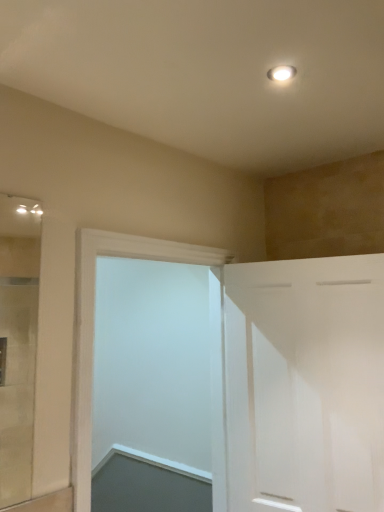
Question: In which direction should I rotate to look at white smooth door at center, acting as the first door starting from the left?

Choices:
 (A) left
 (B) right

Answer: (A)

Question: Is white matte cabinet at right, arranged as the first door when viewed from the right, facing away from white smooth door at center, the second door in the right-to-left sequence?

Choices:
 (A) yes
 (B) no

Answer: (B)

Question: Is white matte cabinet at right, arranged as the first door when viewed from the right, facing towards white smooth door at center, acting as the first door starting from the left?

Choices:
 (A) no
 (B) yes

Answer: (A)

Question: Is white matte cabinet at right, arranged as the first door when viewed from the right, taller than white smooth door at center, the second door in the right-to-left sequence?

Choices:
 (A) yes
 (B) no

Answer: (B)

Question: From a real-world perspective, is white matte cabinet at right, arranged as the first door when viewed from the right, below white smooth door at center, the second door in the right-to-left sequence?

Choices:
 (A) no
 (B) yes

Answer: (B)

Question: Is white matte cabinet at right, arranged as the first door when viewed from the right, wider than white smooth door at center, the second door in the right-to-left sequence?

Choices:
 (A) no
 (B) yes

Answer: (A)

Question: Is white matte cabinet at right, the 2th door from the left, not within white smooth door at center, acting as the first door starting from the left?

Choices:
 (A) no
 (B) yes

Answer: (B)

Question: Are white smooth door at center, acting as the first door starting from the left, and white matte cabinet at right, arranged as the first door when viewed from the right, beside each other?

Choices:
 (A) no
 (B) yes

Answer: (A)

Question: Is white smooth door at center, acting as the first door starting from the left, shorter than white matte cabinet at right, arranged as the first door when viewed from the right?

Choices:
 (A) yes
 (B) no

Answer: (B)

Question: Is white smooth door at center, the second door in the right-to-left sequence, turned away from white matte cabinet at right, arranged as the first door when viewed from the right?

Choices:
 (A) no
 (B) yes

Answer: (A)

Question: Is white matte cabinet at right, the 2th door from the left, a part of white smooth door at center, the second door in the right-to-left sequence?

Choices:
 (A) no
 (B) yes

Answer: (A)

Question: Is white smooth door at center, acting as the first door starting from the left, closer to the viewer compared to white matte cabinet at right, arranged as the first door when viewed from the right?

Choices:
 (A) yes
 (B) no

Answer: (A)

Question: Is white smooth door at center, acting as the first door starting from the left, outside white matte cabinet at right, the 2th door from the left?

Choices:
 (A) no
 (B) yes

Answer: (B)

Question: In terms of size, does white matte cabinet at right, the 2th door from the left, appear bigger or smaller than white smooth door at center, the second door in the right-to-left sequence?

Choices:
 (A) small
 (B) big

Answer: (A)